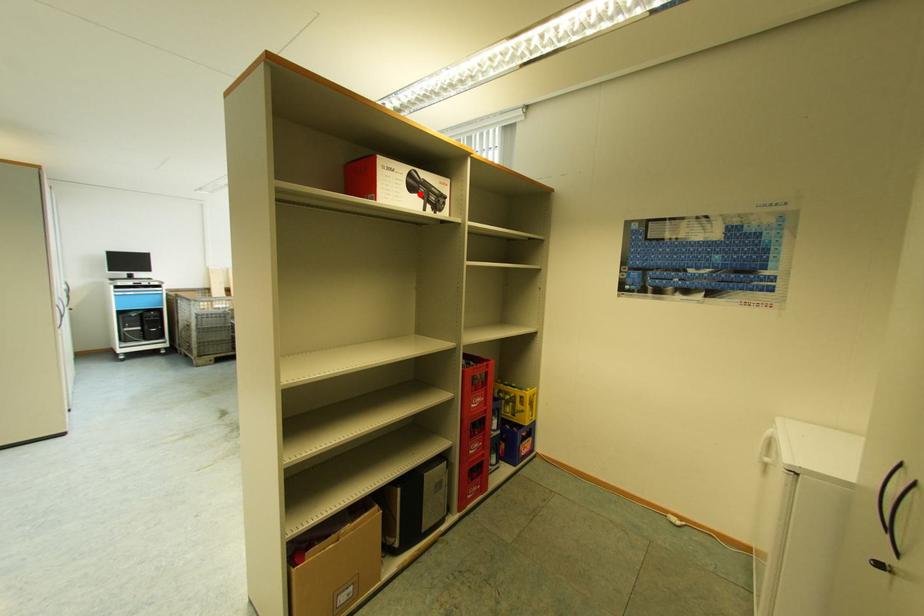
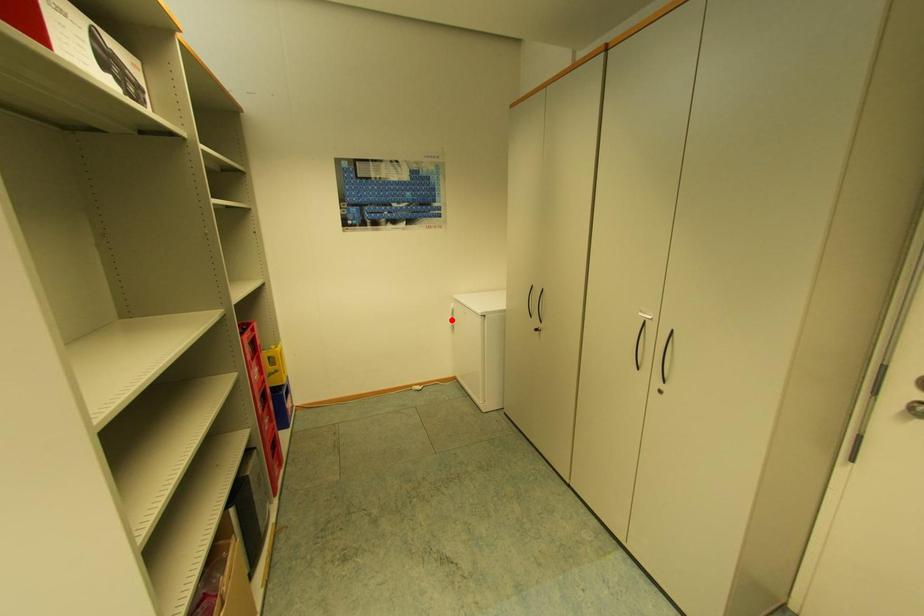
I am providing you with two images of the same scene from different viewpoints. A red point is marked on the first image and another point is marked on the second image. Is the marked point in image1 the same physical position as the marked point in image2?

No